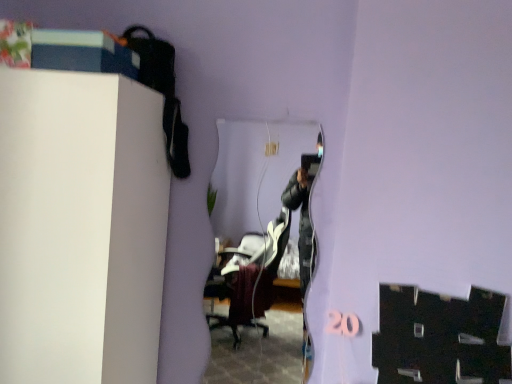
Question: Can you confirm if clear glass mirror at center is wider than white matte cabinet at upper left?

Choices:
 (A) no
 (B) yes

Answer: (A)

Question: Can you confirm if clear glass mirror at center is shorter than white matte cabinet at upper left?

Choices:
 (A) yes
 (B) no

Answer: (A)

Question: Can you confirm if clear glass mirror at center is smaller than white matte cabinet at upper left?

Choices:
 (A) yes
 (B) no

Answer: (A)

Question: Is clear glass mirror at center at the left side of white matte cabinet at upper left?

Choices:
 (A) no
 (B) yes

Answer: (A)

Question: Would you say white matte cabinet at upper left is part of clear glass mirror at center's contents?

Choices:
 (A) yes
 (B) no

Answer: (B)

Question: Is white matte cabinet at upper left at the back of clear glass mirror at center?

Choices:
 (A) no
 (B) yes

Answer: (A)

Question: Could you tell me if white matte cabinet at upper left is facing clear glass mirror at center?

Choices:
 (A) yes
 (B) no

Answer: (B)

Question: Is white matte cabinet at upper left smaller than clear glass mirror at center?

Choices:
 (A) yes
 (B) no

Answer: (B)

Question: From a real-world perspective, does white matte cabinet at upper left sit lower than clear glass mirror at center?

Choices:
 (A) no
 (B) yes

Answer: (B)

Question: Are white matte cabinet at upper left and clear glass mirror at center making contact?

Choices:
 (A) no
 (B) yes

Answer: (A)

Question: Does white matte cabinet at upper left have a lesser width compared to clear glass mirror at center?

Choices:
 (A) no
 (B) yes

Answer: (A)

Question: Would you say white matte cabinet at upper left is a long distance from clear glass mirror at center?

Choices:
 (A) no
 (B) yes

Answer: (B)

Question: Does point (283, 281) appear closer or farther from the camera than point (86, 221)?

Choices:
 (A) farther
 (B) closer

Answer: (A)